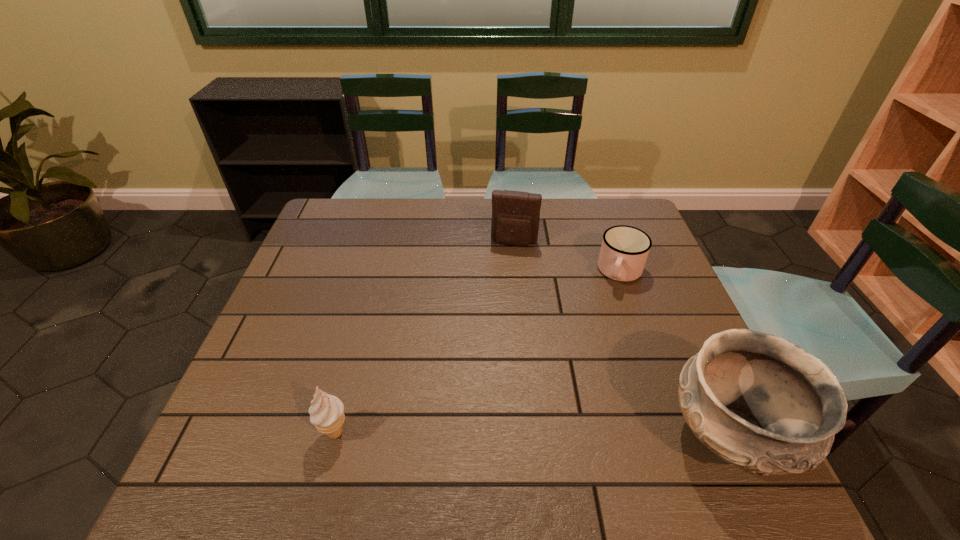
Locate an element on the screen. The image size is (960, 540). vacant space situated with an open flap on the second object from left to right is located at coordinates (504, 291).

Where is `free location located 0.400m on the side of the mug with the handle`? free location located 0.400m on the side of the mug with the handle is located at coordinates (573, 408).

Find the location of a particular element. vacant space located on the side of the mug with the handle is located at coordinates (608, 314).

Identify the location of vacant area situated 0.090m on the side of the mug with the handle. (609, 311).

Identify the location of object that is at the far edge. Image resolution: width=960 pixels, height=540 pixels. (515, 220).

Where is `icecream located at the near edge`? Image resolution: width=960 pixels, height=540 pixels. icecream located at the near edge is located at coordinates (326, 412).

Locate an element on the screen. The width and height of the screenshot is (960, 540). pottery located in the near edge section of the desktop is located at coordinates (762, 403).

Where is `pottery at the right edge`? This screenshot has width=960, height=540. pottery at the right edge is located at coordinates (762, 403).

This screenshot has height=540, width=960. What are the coordinates of `mug present at the right edge` in the screenshot? It's located at point(624,250).

Where is `object at the near right corner`? The width and height of the screenshot is (960, 540). object at the near right corner is located at coordinates (762, 403).